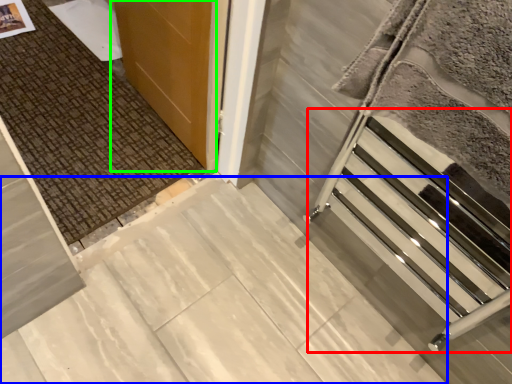
Question: Based on their relative distances, which object is nearer to stairwell (highlighted by a red box)? Choose from concrete (highlighted by a blue box) and door (highlighted by a green box).

Choices:
 (A) concrete
 (B) door

Answer: (A)